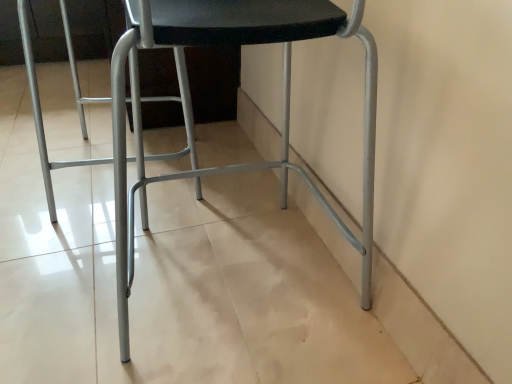
Locate an element on the screen. Image resolution: width=512 pixels, height=384 pixels. free area behind metallic gray chair at center is located at coordinates (234, 190).